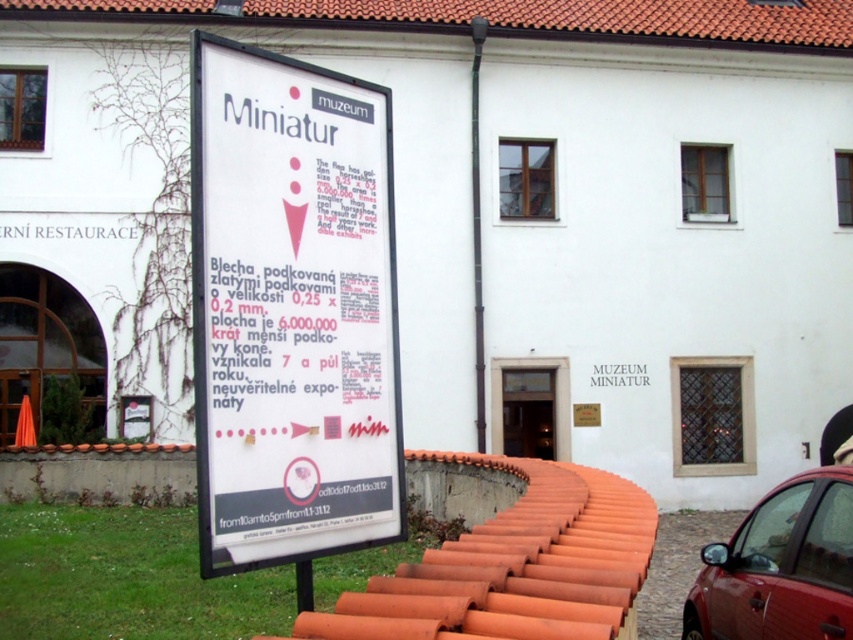
Which of these two, white paper sign at center or shiny red car at lower right, stands shorter?

Standing shorter between the two is shiny red car at lower right.

Is white paper sign at center closer to the viewer compared to shiny red car at lower right?

Yes, white paper sign at center is closer to the viewer.

This screenshot has height=640, width=853. I want to click on white paper sign at center, so pyautogui.click(x=291, y=308).